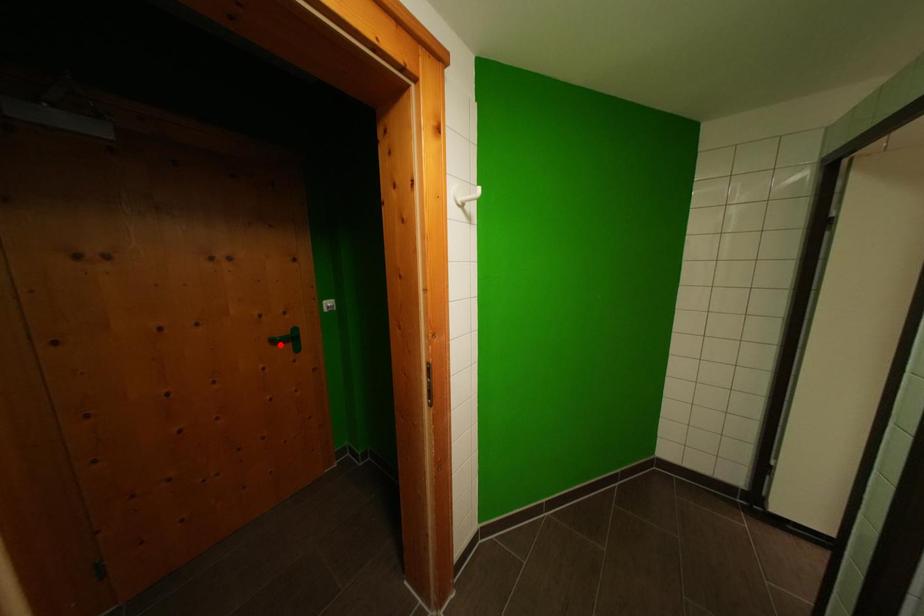
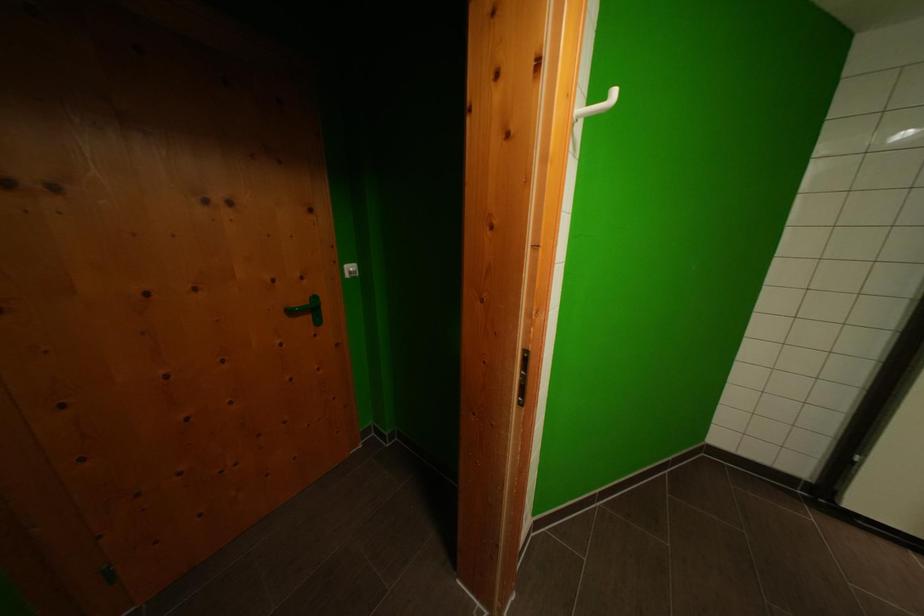
Where in the second image is the point corresponding to the highlighted location from the first image?

(297, 315)